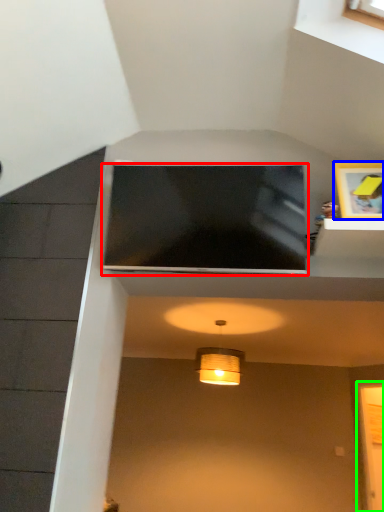
Question: Estimate the real-world distances between objects in this image. Which object is farther from television (highlighted by a red box), picture frame (highlighted by a blue box) or glass door (highlighted by a green box)?

Choices:
 (A) picture frame
 (B) glass door

Answer: (B)